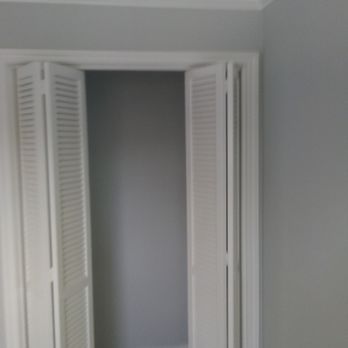
Where is `walls`? walls is located at coordinates (317, 242).